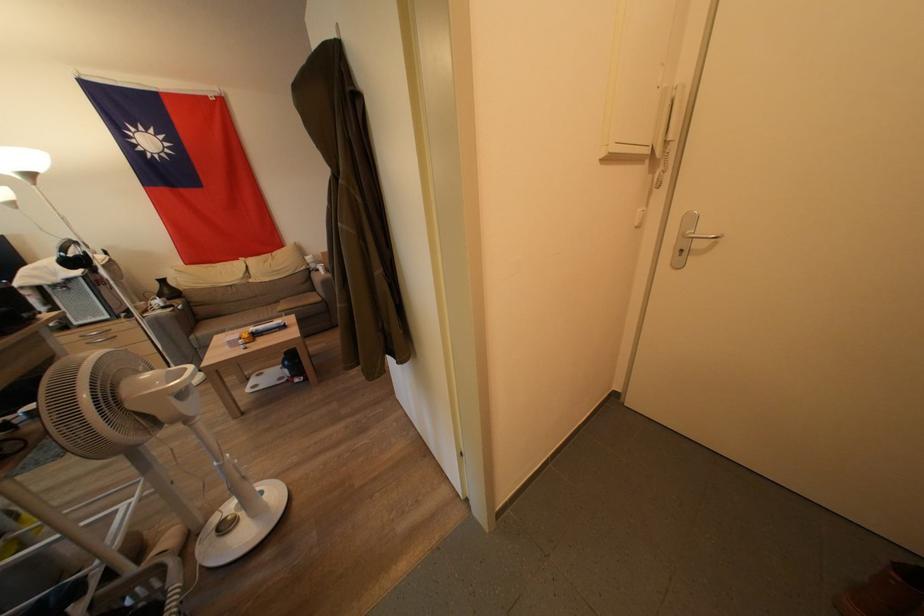
The width and height of the screenshot is (924, 616). What do you see at coordinates (322, 284) in the screenshot?
I see `a sofa armrest` at bounding box center [322, 284].